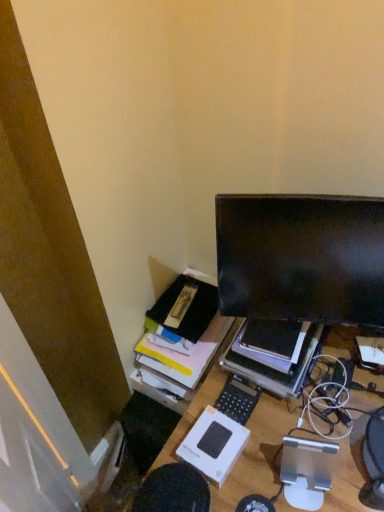
Question: Considering the relative positions of matte black monitor at upper right and black matte monitor at upper right in the image provided, is matte black monitor at upper right to the left of black matte monitor at upper right from the viewer's perspective?

Choices:
 (A) no
 (B) yes

Answer: (A)

Question: Is matte black monitor at upper right bigger than black matte monitor at upper right?

Choices:
 (A) yes
 (B) no

Answer: (B)

Question: Does matte black monitor at upper right come in front of black matte monitor at upper right?

Choices:
 (A) yes
 (B) no

Answer: (A)

Question: Can you confirm if matte black monitor at upper right is wider than black matte monitor at upper right?

Choices:
 (A) yes
 (B) no

Answer: (B)

Question: From a real-world perspective, does matte black monitor at upper right stand above black matte monitor at upper right?

Choices:
 (A) yes
 (B) no

Answer: (A)

Question: Is there a large distance between matte black monitor at upper right and black matte monitor at upper right?

Choices:
 (A) yes
 (B) no

Answer: (B)

Question: From a real-world perspective, is black plastic calculator at center on wooden desk at center?

Choices:
 (A) no
 (B) yes

Answer: (B)

Question: Considering the relative sizes of black plastic calculator at center and wooden desk at center in the image provided, is black plastic calculator at center shorter than wooden desk at center?

Choices:
 (A) no
 (B) yes

Answer: (B)

Question: From a real-world perspective, is black plastic calculator at center beneath wooden desk at center?

Choices:
 (A) no
 (B) yes

Answer: (A)

Question: From the image's perspective, does black plastic calculator at center appear lower than wooden desk at center?

Choices:
 (A) yes
 (B) no

Answer: (B)

Question: Does black plastic calculator at center have a larger size compared to wooden desk at center?

Choices:
 (A) yes
 (B) no

Answer: (B)

Question: Is black plastic calculator at center aimed at wooden desk at center?

Choices:
 (A) yes
 (B) no

Answer: (B)

Question: Does matte black monitor at upper right touch black plastic calculator at center?

Choices:
 (A) no
 (B) yes

Answer: (A)